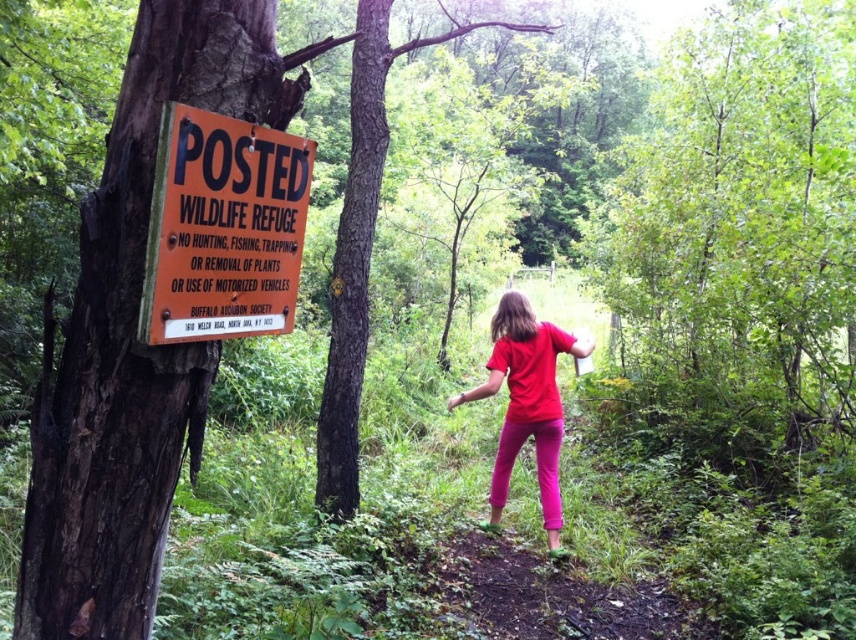
You are standing at point (205, 264). The sign is 5.04 feet away from you. If you walk straight towards the sign, will you reach it before the path curves to the right?

Answer: The sign is 5.04 feet away from you at point (205, 264). Since the path curves to the right, you might not reach the sign before the path changes direction. However, the distance is short, so it depends on how soon the path curves. Without knowing the curvature details, it is uncertain.

You are a hiker who wants to take a photo of the orange paper sign at left and the matte red shirt at center. Which object should you focus on first if you want to capture both in the same frame without moving your camera?

The orange paper sign at left is not as tall as the matte red shirt at center, so you should focus on the matte red shirt at center first to ensure both are in frame.

You are standing at the sign in the forest and want to walk to the point marked by point [223,308]. Which direction should you go relative to point [538,385]?

You should walk towards point [223,308], which is in front of point [538,385], so the direction is towards the front relative to point [538,385].